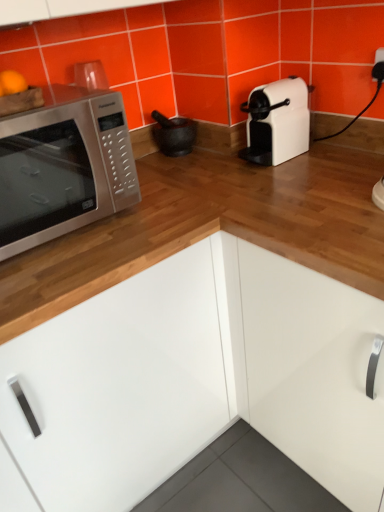
Question: Should I look upward or downward to see satin silver microwave at left?

Choices:
 (A) down
 (B) up

Answer: (B)

Question: Is the position of matte black mortar at center more distant than that of satin silver microwave at left?

Choices:
 (A) no
 (B) yes

Answer: (B)

Question: Is matte black mortar at center taller than satin silver microwave at left?

Choices:
 (A) no
 (B) yes

Answer: (A)

Question: Is matte black mortar at center at the right side of satin silver microwave at left?

Choices:
 (A) no
 (B) yes

Answer: (B)

Question: Is matte black mortar at center positioned with its back to satin silver microwave at left?

Choices:
 (A) no
 (B) yes

Answer: (A)

Question: Considering the relative positions of matte black mortar at center and satin silver microwave at left in the image provided, is matte black mortar at center to the left of satin silver microwave at left from the viewer's perspective?

Choices:
 (A) no
 (B) yes

Answer: (A)

Question: From the image's perspective, is matte black mortar at center on top of satin silver microwave at left?

Choices:
 (A) no
 (B) yes

Answer: (B)

Question: Does matte black mortar at center have a lesser width compared to white glossy cabinet at center?

Choices:
 (A) no
 (B) yes

Answer: (B)

Question: Would you say matte black mortar at center is a long distance from white glossy cabinet at center?

Choices:
 (A) no
 (B) yes

Answer: (A)

Question: Is matte black mortar at center wider than white glossy cabinet at center?

Choices:
 (A) no
 (B) yes

Answer: (A)

Question: Does matte black mortar at center lie in front of white glossy cabinet at center?

Choices:
 (A) no
 (B) yes

Answer: (A)

Question: Does matte black mortar at center have a smaller size compared to white glossy cabinet at center?

Choices:
 (A) no
 (B) yes

Answer: (B)

Question: Considering the relative positions of matte black mortar at center and white glossy cabinet at center in the image provided, is matte black mortar at center to the right of white glossy cabinet at center from the viewer's perspective?

Choices:
 (A) yes
 (B) no

Answer: (B)

Question: Is white glossy cabinet at center in front of satin silver microwave at left?

Choices:
 (A) yes
 (B) no

Answer: (A)